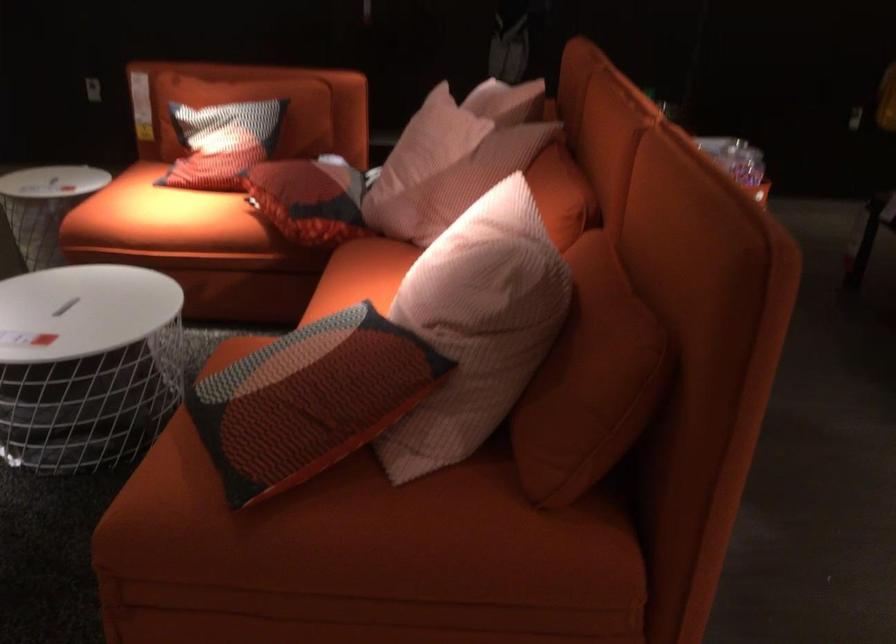
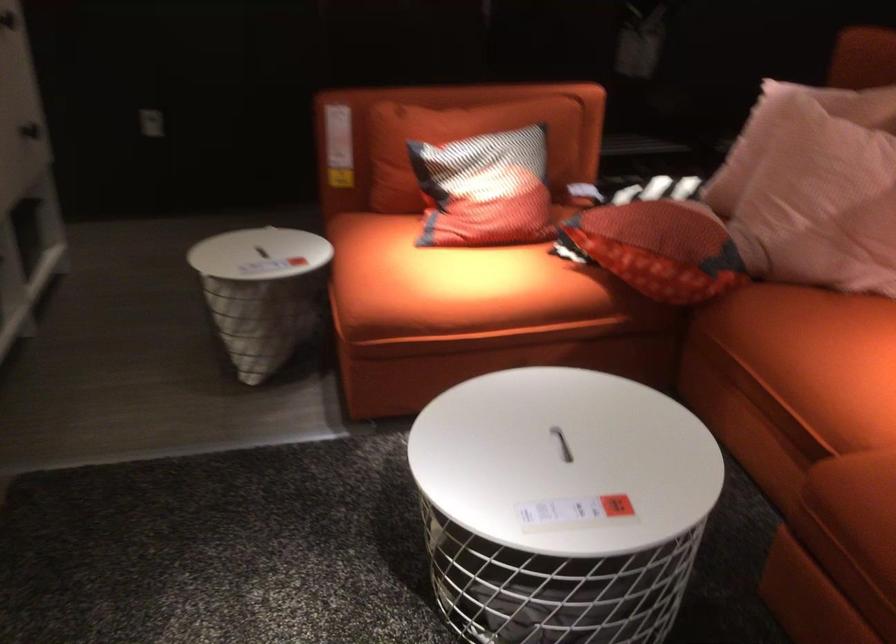
Find the pixel in the second image that matches (213,147) in the first image.

(485, 190)